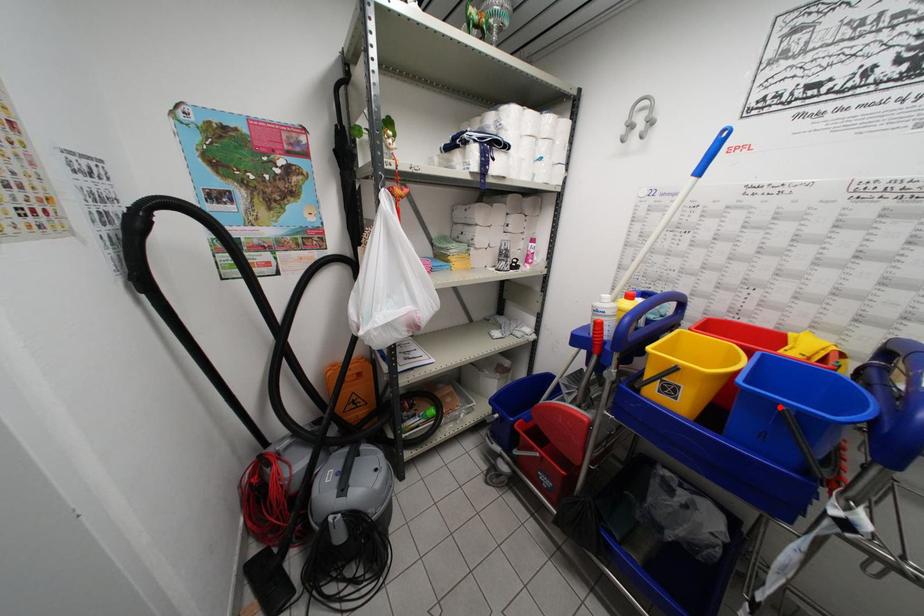
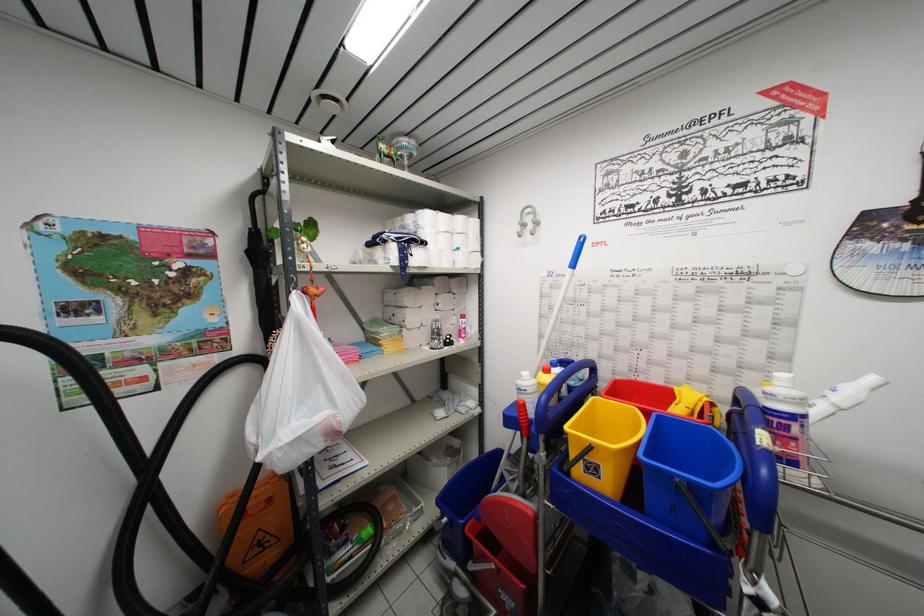
Find the pixel in the second image that matches the highlighted location in the first image.

(675, 479)